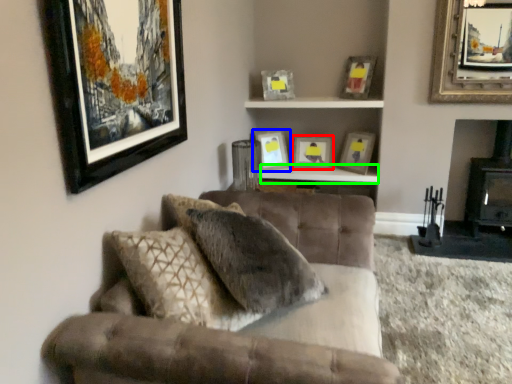
Question: Considering the real-world distances, which object is farthest from picture frame (highlighted by a red box)? picture frame (highlighted by a blue box) or table (highlighted by a green box)?

Choices:
 (A) picture frame
 (B) table

Answer: (A)